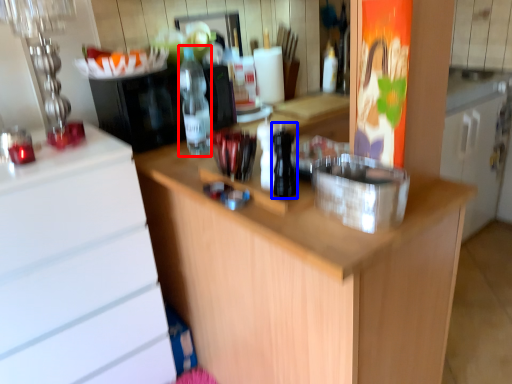
Question: Among these objects, which one is farthest to the camera, bottle (highlighted by a red box) or bottle (highlighted by a blue box)?

Choices:
 (A) bottle
 (B) bottle

Answer: (A)